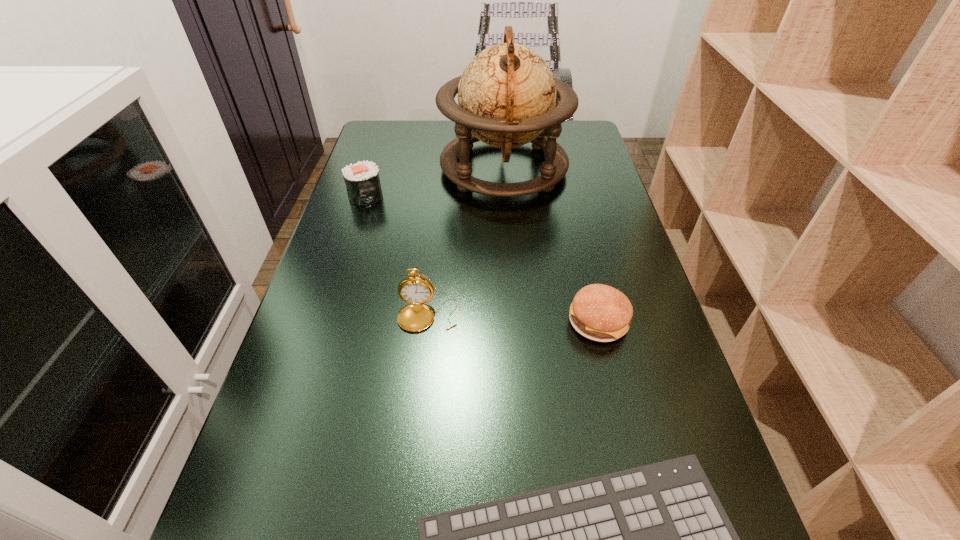
The width and height of the screenshot is (960, 540). What are the coordinates of `free space between the pocket watch and the second shortest object` in the screenshot? It's located at (513, 318).

What are the coordinates of `vacant area between the globe and the third shortest object` in the screenshot? It's located at (435, 182).

Select which object appears as the fourth closest to the pocket watch. Please provide its 2D coordinates. Your answer should be formatted as a tuple, i.e. [(x, y)], where the tuple contains the x and y coordinates of a point satisfying the conditions above.

[(362, 180)]

Where is `object that is the second closest to the hamburger`? object that is the second closest to the hamburger is located at coordinates (415, 290).

The height and width of the screenshot is (540, 960). What are the coordinates of `free space that satisfies the following two spatial constraints: 1. on the back side of the sushi; 2. on the right side of the tallest object` in the screenshot? It's located at pos(374,168).

The width and height of the screenshot is (960, 540). Identify the location of vacant space that satisfies the following two spatial constraints: 1. on the back side of the sushi; 2. on the left side of the tallest object. (374, 168).